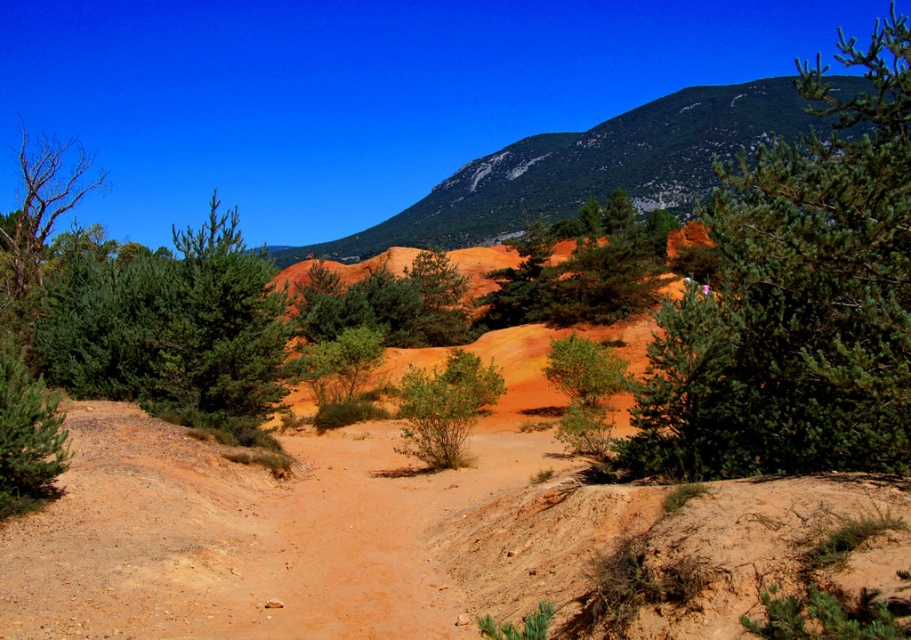
Is green needle-like tree at center-right wider than green textured pine at center?

Indeed, green needle-like tree at center-right has a greater width compared to green textured pine at center.

Can you confirm if green needle-like tree at center-right is positioned to the right of green textured pine at center?

Indeed, green needle-like tree at center-right is positioned on the right side of green textured pine at center.

Is point (695, 296) behind point (193, 296)?

No, it is not.

Where is `green needle-like tree at center-right`? The width and height of the screenshot is (911, 640). green needle-like tree at center-right is located at coordinates (797, 298).

Can you confirm if green rocky mountain at upper center is thinner than green matte bush at center?

No.

What do you see at coordinates (587, 170) in the screenshot? The height and width of the screenshot is (640, 911). I see `green rocky mountain at upper center` at bounding box center [587, 170].

Is point (592, 150) behind point (466, 380)?

Yes.

The image size is (911, 640). I want to click on green rocky mountain at upper center, so click(x=587, y=170).

Who is positioned more to the right, green rocky mountain at upper center or green textured pine at center?

From the viewer's perspective, green rocky mountain at upper center appears more on the right side.

Does point (763, 132) come closer to viewer compared to point (265, 321)?

No.

Find the location of `green rocky mountain at upper center`. green rocky mountain at upper center is located at coordinates (587, 170).